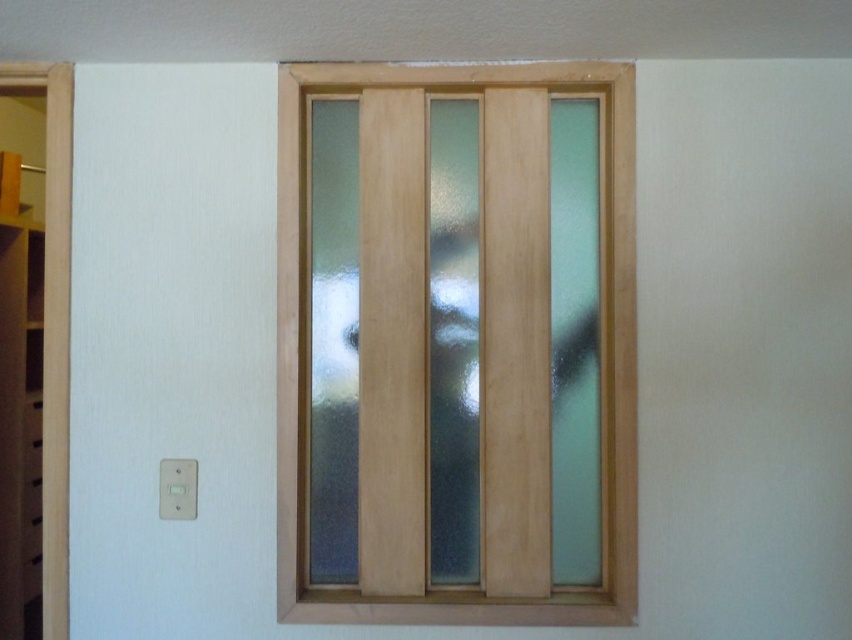
You are standing 5 feet away from a wall with a window. There is a point marked at coordinates point (371, 620) on the wall. Can you reach the point with a 3 foot long stick if you are holding it horizontally?

The distance of point (371, 620) from viewer is 5.77 feet. Since you are standing 5 feet away from the wall, the total distance to the point is 5 feet plus 5.77 feet, which is 10.77 feet. The stick is only 3 feet long, so you cannot reach the point.

You are an interior designer planning to install a new door handle. The frosted glass door at center and the white wood door at left are both in the same room. Which door requires a wider handle to accommodate its width?

The frosted glass door at center requires a wider handle because its width is larger than the white wood door at left.

You are standing in front of the wall with the window and shelving unit. There are two points marked on the wall. One is at coordinate point [286,230] and the other is at point [68,161]. Which point is closer to you?

Point [286,230] is closer to the viewer than point [68,161].